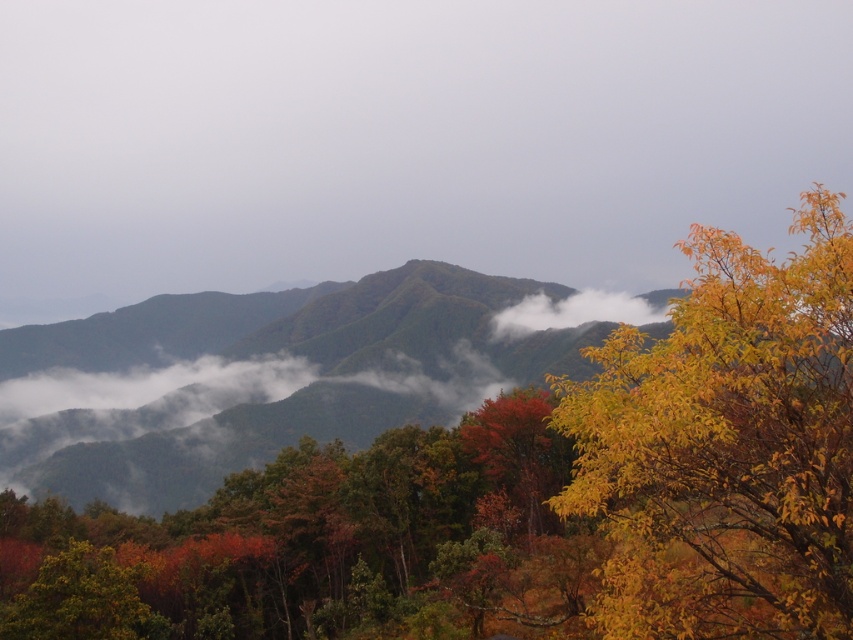
You are a hiker standing at the edge of the mountain path and see the white mist at center and the white fluffy cloud at center in the distance. Which one is closer to you?

The white mist at center is closer to you because it is further to the viewer than the white fluffy cloud at center.

You are an artist trying to sketch this mountain landscape. You want to ensure the yellow leafy tree at right and the white fluffy cloud at center are proportionally accurate. Which object should you draw smaller?

The yellow leafy tree at right should be drawn smaller than the white fluffy cloud at center because the description states that the yellow leafy tree at right has a smaller size compared to the white fluffy cloud at center.